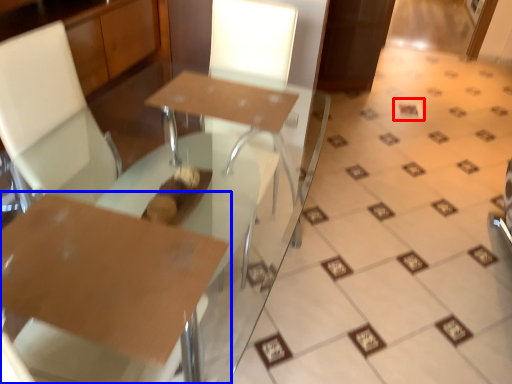
Question: Which point is further to the camera, square (highlighted by a red box) or table (highlighted by a blue box)?

Choices:
 (A) square
 (B) table

Answer: (A)